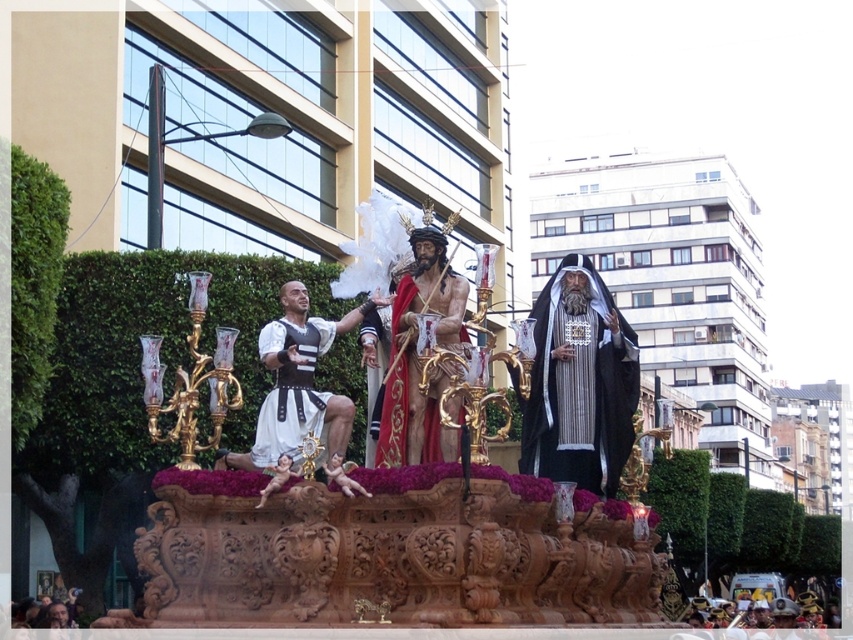
Where is the wooden carved figure at center?

The wooden carved figure at center is located at point (390, 416).

Based on the photo, you are a participant in the religious procession and need to place a decorative item between the white matte fabric at center and the smooth pink cherub at center on the float. What is the minimum distance you should maintain between them to ensure the item fits without overlapping?

The white matte fabric at center and smooth pink cherub at center are 3.11 meters apart from each other, so the decorative item should be placed at least 3.11 meters away from both to avoid overlapping.

You are an artist trying to recreate the float. You have both the white matte fabric at center and the smooth pink cherub at center in your materials. Which one should you make bigger?

The white matte fabric at center should be made bigger since it is larger in size than the smooth pink cherub at center according to the description.